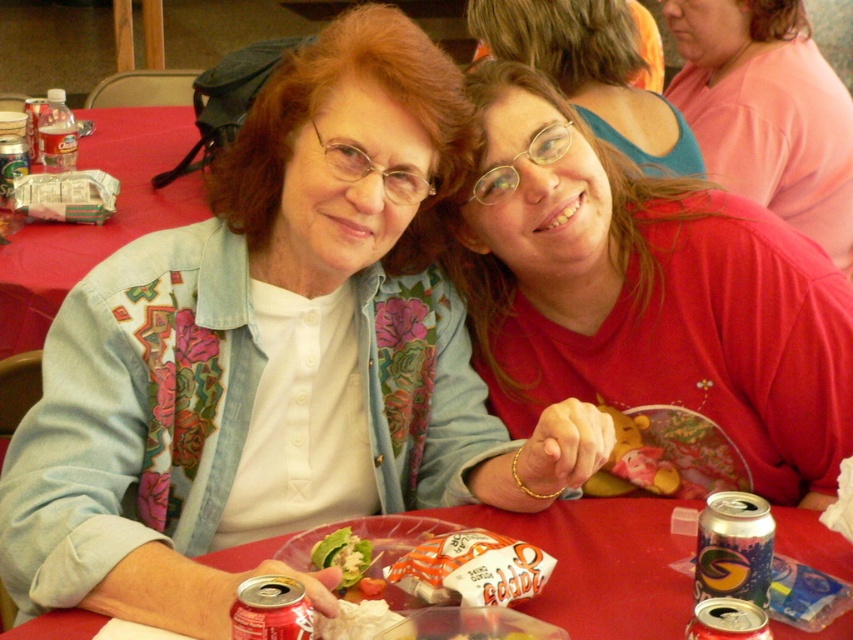
Between matte blue jacket at center and green leafy salad at center, which one has less height?

green leafy salad at center

How far apart are matte blue jacket at center and green leafy salad at center?

matte blue jacket at center is 34.33 centimeters from green leafy salad at center.

Locate an element on the screen. This screenshot has height=640, width=853. matte blue jacket at center is located at coordinates (274, 356).

Who is taller, pink matte shirt at upper right or shiny metallic soda can at lower right?

pink matte shirt at upper right

Between pink matte shirt at upper right and shiny metallic soda can at lower right, which one appears on the left side from the viewer's perspective?

Positioned to the left is shiny metallic soda can at lower right.

At what (x,y) coordinates should I click in order to perform the action: click on pink matte shirt at upper right. Please return your answer as a coordinate pair (x, y). Looking at the image, I should click on (767, 112).

The height and width of the screenshot is (640, 853). Describe the element at coordinates (274, 356) in the screenshot. I see `matte blue jacket at center` at that location.

Is point (589, 445) behind point (807, 84)?

No.

Image resolution: width=853 pixels, height=640 pixels. Identify the location of matte blue jacket at center. (274, 356).

Where is `matte blue jacket at center`? This screenshot has height=640, width=853. matte blue jacket at center is located at coordinates (274, 356).